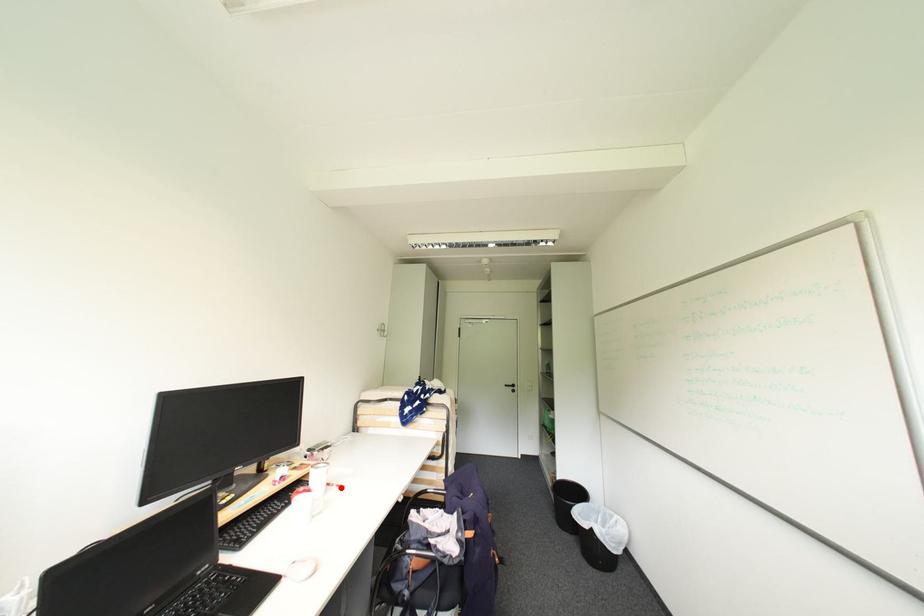
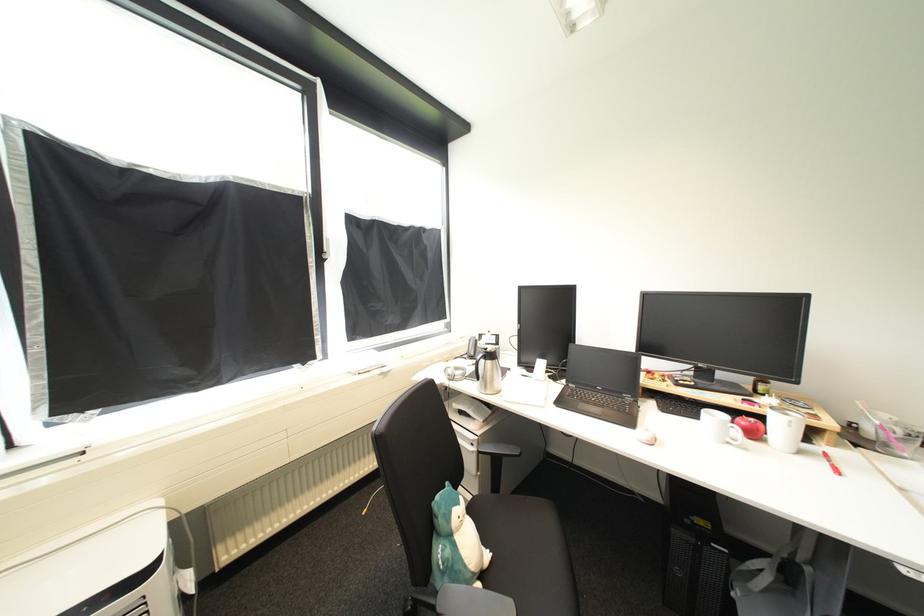
The point at the highlighted location is marked in the first image. Where is the corresponding point in the second image?

(834, 464)